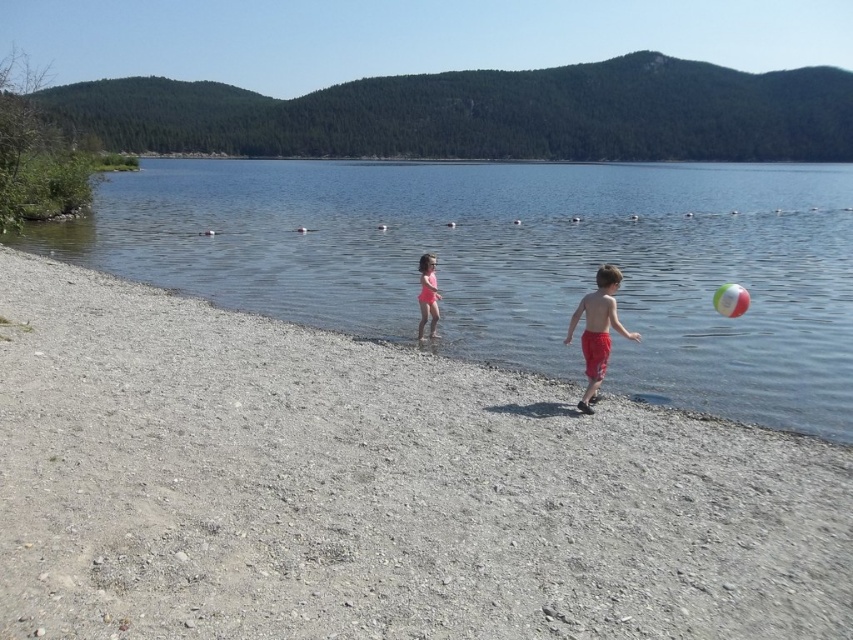
You are standing at the shoreline looking towards the lake. There are two points marked on the image. The first point is at coordinates point (582, 307) and the second point is at point (419, 304). Which point is closer to you?

Point (582, 307) is in front of point (419, 304), so it is closer to you.

You are a photographer trying to capture a candid shot of the two children playing on the lakeside beach. You want to ensure both the red cotton shorts at center and the pink matte swimsuit at center are visible in the frame. Based on their positions, which child should you focus on first to include both in the shot?

The red cotton shorts at center is to the right of the pink matte swimsuit at center, so focusing on the child wearing the pink matte swimsuit at center first would allow you to frame the shot to include both children since the red cotton shorts at center is positioned to its right.

In the scene shown: You are standing at the lakeside and want to walk from point A to point B. Point A is located at coordinates point [566,484] and point B is at coordinates point [715,300]. Which point is closer to you when you start walking?

Point point [566,484] is in front of point point [715,300], so when you start walking from the lakeside, point point [566,484] will be closer to you than point point [715,300].